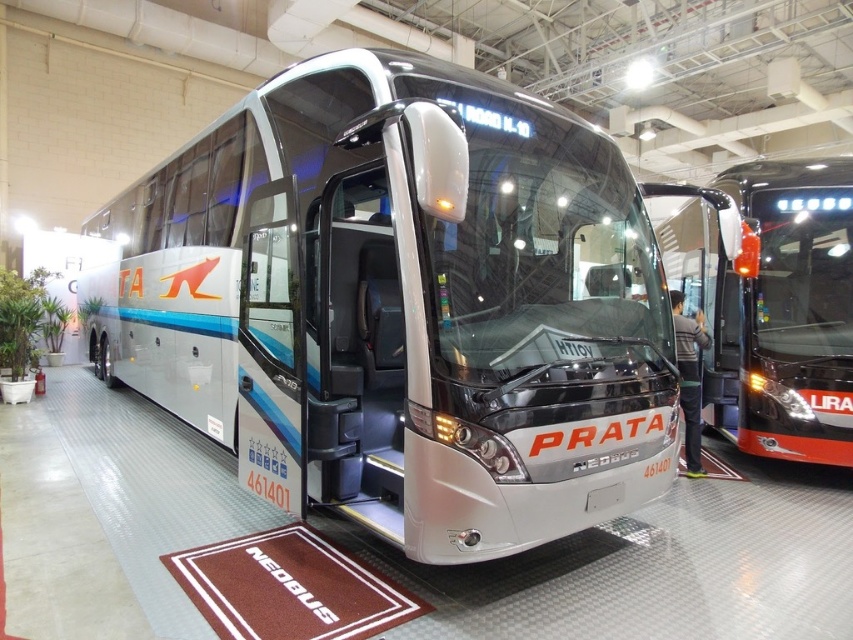
Question: Which point is farther to the camera?

Choices:
 (A) (93, 225)
 (B) (836, 227)

Answer: (A)

Question: Can you confirm if sleek silver bus at center is bigger than shiny black bus at right?

Choices:
 (A) no
 (B) yes

Answer: (A)

Question: Which of the following is the farthest from the observer?

Choices:
 (A) (718, 387)
 (B) (674, 321)
 (C) (392, 403)

Answer: (A)

Question: Can you confirm if sleek silver bus at center is positioned to the right of shiny black bus at right?

Choices:
 (A) no
 (B) yes

Answer: (A)

Question: Based on their relative distances, which object is farther from the shiny black bus at right?

Choices:
 (A) sleek silver coach at center
 (B) sleek silver bus at center

Answer: (B)

Question: Observing the image, what is the correct spatial positioning of shiny black bus at right in reference to sleek silver coach at center?

Choices:
 (A) above
 (B) below

Answer: (A)